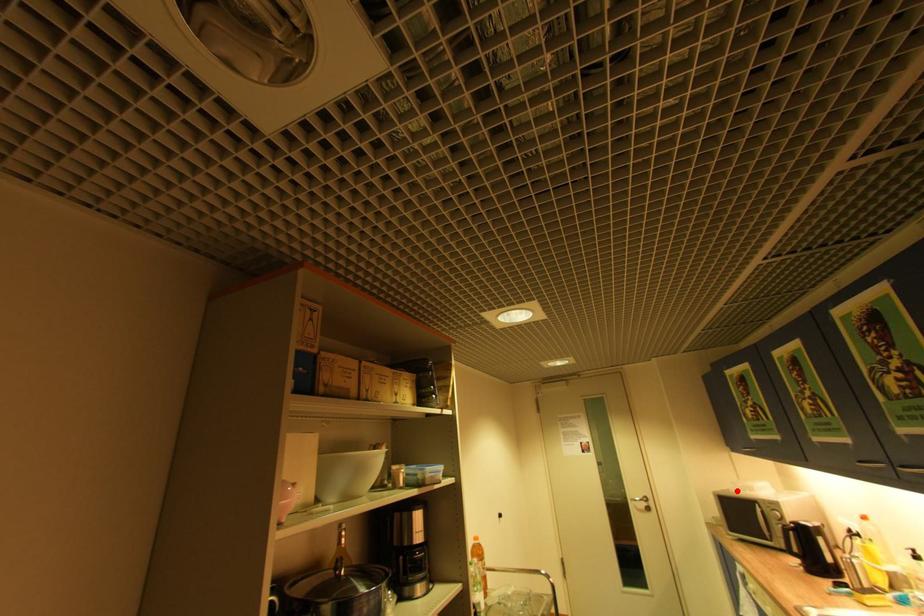
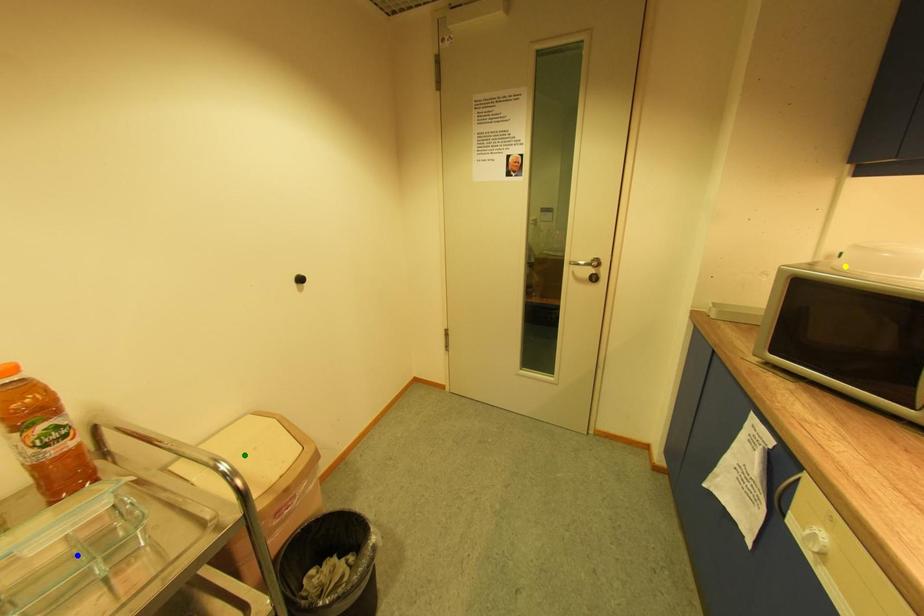
Question: I am providing you with two images of the same scene from different viewpoints. A red point is marked on the first image. You are given multiple points on the second image. Which point in image 2 represents the same 3d spot as the red point in image 1?

Choices:
 (A) green point
 (B) yellow point
 (C) blue point

Answer: (B)